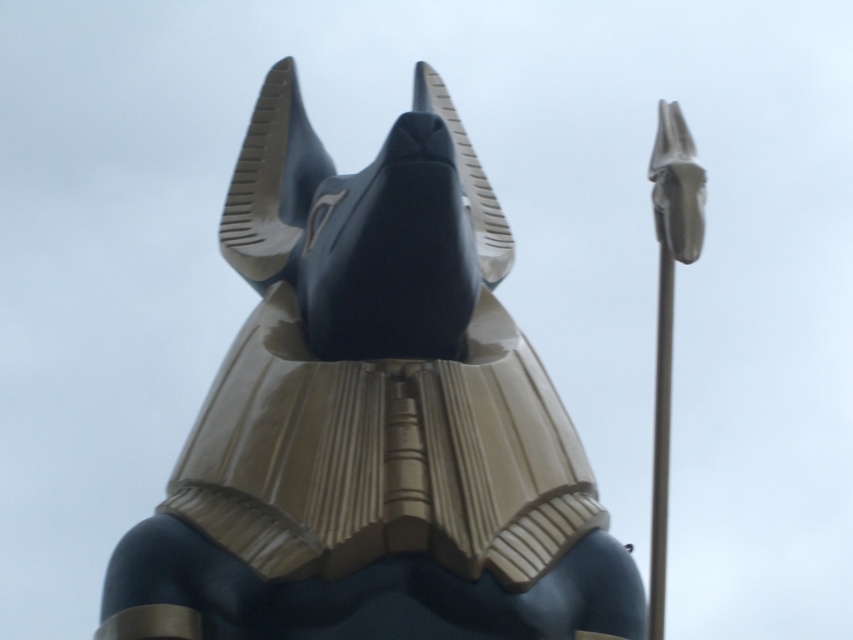
Which of these two, glossy gold statue at center or silver metallic pole at right, stands shorter?

With less height is silver metallic pole at right.

Who is more forward, (254, 477) or (653, 592)?

Point (254, 477) is more forward.

What do you see at coordinates (373, 419) in the screenshot? I see `glossy gold statue at center` at bounding box center [373, 419].

This screenshot has height=640, width=853. Identify the location of glossy gold statue at center. (373, 419).